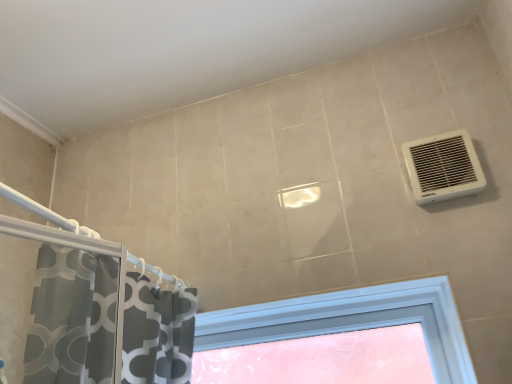
Question: Can you confirm if translucent plastic window at center is shorter than white plastic vent at upper right?

Choices:
 (A) yes
 (B) no

Answer: (B)

Question: Is translucent plastic window at center behind white plastic vent at upper right?

Choices:
 (A) yes
 (B) no

Answer: (A)

Question: Is translucent plastic window at center touching white plastic vent at upper right?

Choices:
 (A) yes
 (B) no

Answer: (B)

Question: Considering the relative positions of translucent plastic window at center and white plastic vent at upper right in the image provided, is translucent plastic window at center to the left of white plastic vent at upper right from the viewer's perspective?

Choices:
 (A) no
 (B) yes

Answer: (B)

Question: Is translucent plastic window at center to the right of white plastic vent at upper right from the viewer's perspective?

Choices:
 (A) no
 (B) yes

Answer: (A)

Question: Does translucent plastic window at center have a smaller size compared to white plastic vent at upper right?

Choices:
 (A) yes
 (B) no

Answer: (B)

Question: Is white plastic vent at upper right at the left side of translucent plastic window at center?

Choices:
 (A) no
 (B) yes

Answer: (A)

Question: From a real-world perspective, is white plastic vent at upper right positioned under translucent plastic window at center based on gravity?

Choices:
 (A) no
 (B) yes

Answer: (A)

Question: Is translucent plastic window at center surrounded by white plastic vent at upper right?

Choices:
 (A) no
 (B) yes

Answer: (A)

Question: Is white plastic vent at upper right positioned beyond the bounds of translucent plastic window at center?

Choices:
 (A) yes
 (B) no

Answer: (A)

Question: Considering the relative sizes of white plastic vent at upper right and translucent plastic window at center in the image provided, is white plastic vent at upper right shorter than translucent plastic window at center?

Choices:
 (A) no
 (B) yes

Answer: (B)

Question: Is white plastic vent at upper right taller than translucent plastic window at center?

Choices:
 (A) yes
 (B) no

Answer: (B)

Question: Relative to translucent plastic window at center, is white plastic vent at upper right in front or behind?

Choices:
 (A) behind
 (B) front

Answer: (B)